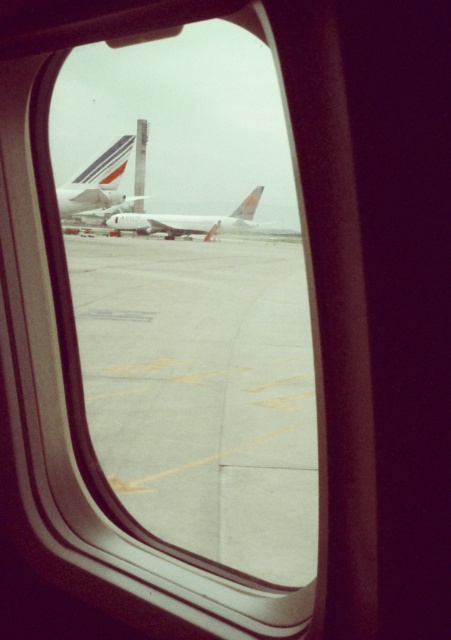
You are a passenger sitting by the window on an airplane. You notice the concrete tarmac at center and the white glossy airplane at center outside. Which object appears larger in your view?

The concrete tarmac at center appears larger because it is much taller than the white glossy airplane at center in the scene.

Consider the image. You are a passenger sitting in the airplane and looking out the window. You see the concrete tarmac at center and the white matte airplane at center. Which object is positioned to the right side of the other?

The concrete tarmac at center is to the right of the white matte airplane at center.

You are a passenger sitting by the window in an airplane. You notice two airplanes outside your window, a white glossy airplane at center and a white matte airplane at center. Which one appears nearer to you?

The white glossy airplane at center appears nearer to you because it is closer to the viewer compared to the white matte airplane at center.